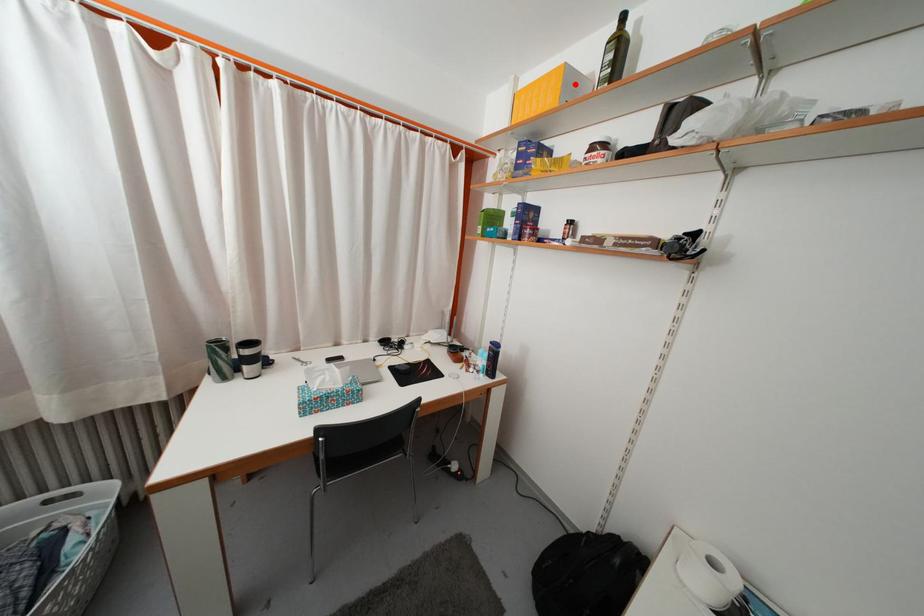
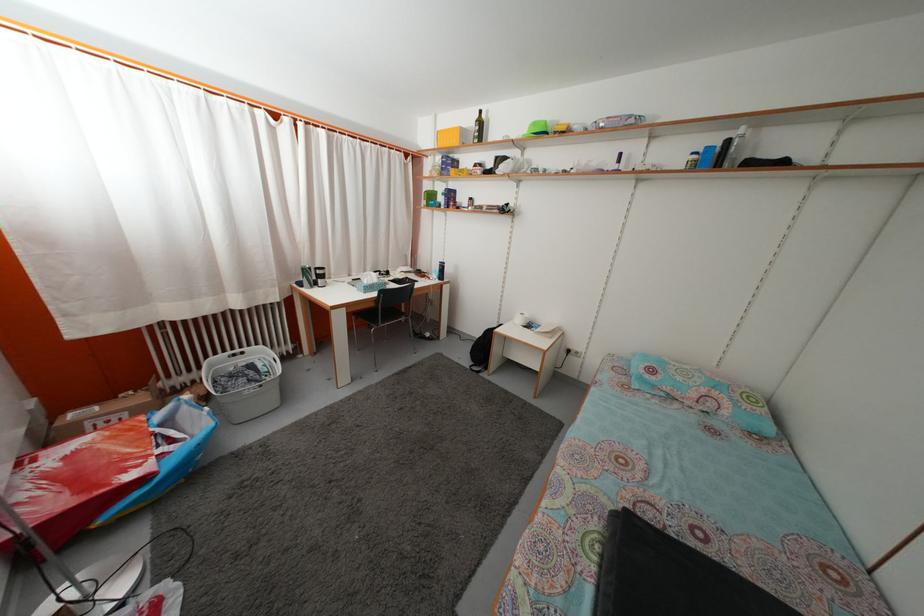
Where in the second image is the point corresponding to the highlighted location from the first image?

(468, 139)